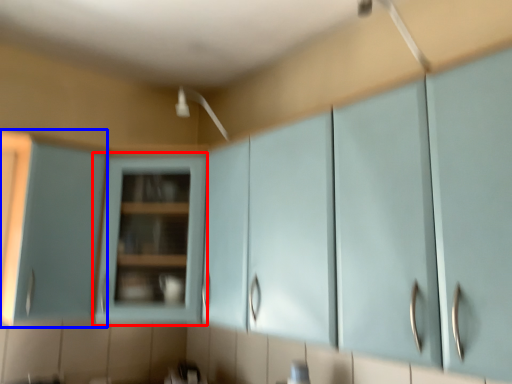
Question: Which of the following is the farthest to the observer, cabinetry (highlighted by a red box) or cabinetry (highlighted by a blue box)?

Choices:
 (A) cabinetry
 (B) cabinetry

Answer: (B)